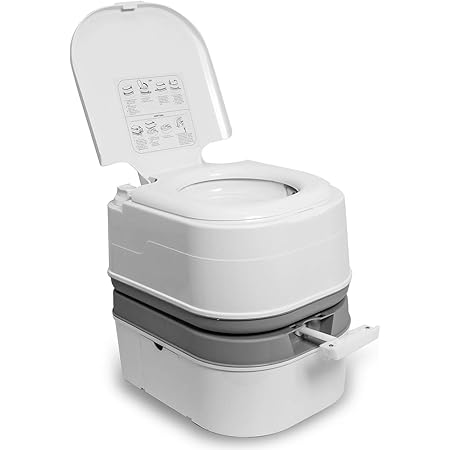
Where is `bowl`? bowl is located at coordinates (241, 196).